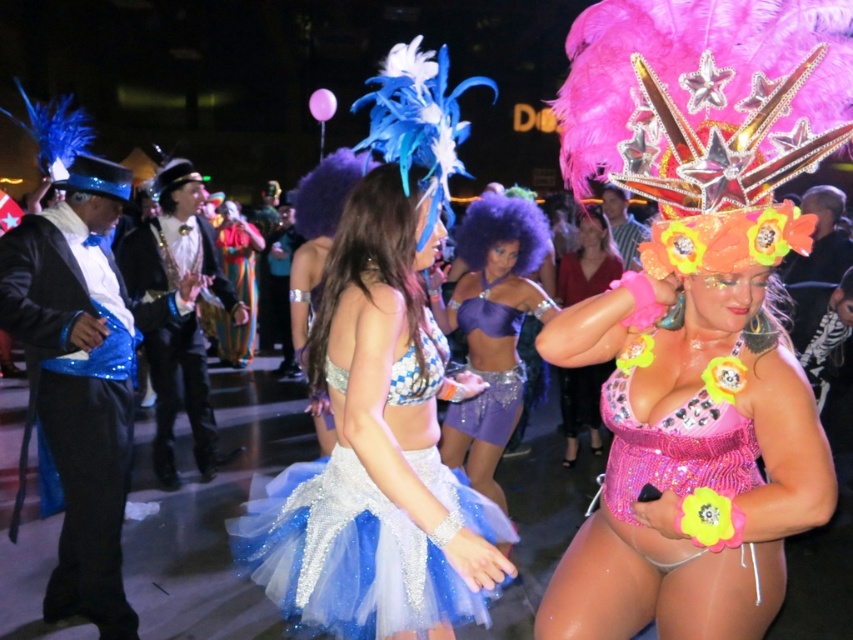
Is point (341, 422) behind point (494, 248)?

That is False.

Is glittery blue tutu at center positioned behind shiny purple bikini top at center?

No.

Does point (352, 237) lie in front of point (505, 388)?

That is True.

I want to click on glittery blue tutu at center, so click(x=376, y=451).

Which is above, glittery blue tutu at center or pink sequined bikini at right?

glittery blue tutu at center is higher up.

Between point (300, 550) and point (560, 385), which one is positioned behind?

The point (560, 385) is more distant.

This screenshot has height=640, width=853. Identify the location of glittery blue tutu at center. (376, 451).

Is point (527, 227) positioned after point (509, 394)?

Yes.

Does shiny purple bikini top at center have a lesser height compared to purple sequined dress at center?

Incorrect, shiny purple bikini top at center's height does not fall short of purple sequined dress at center's.

Identify the location of shiny purple bikini top at center. The image size is (853, 640). (492, 330).